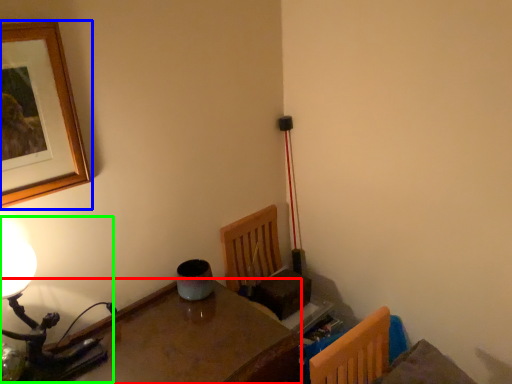
Question: Which is farther away from table (highlighted by a red box)? picture frame (highlighted by a blue box) or table lamp (highlighted by a green box)?

Choices:
 (A) picture frame
 (B) table lamp

Answer: (A)